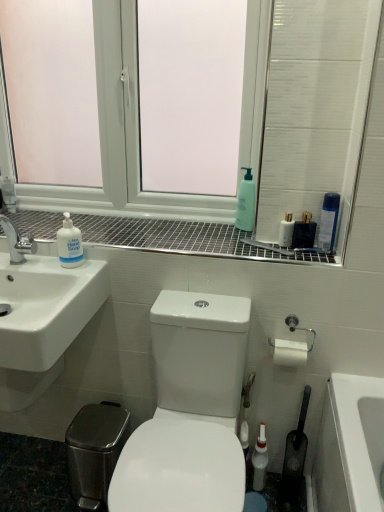
Question: Can white glossy mouthwash at upper right, positioned as the 2th mouthwash in bottom-to-top order, be found inside white glossy sink at lower left?

Choices:
 (A) yes
 (B) no

Answer: (B)

Question: Is white glossy mouthwash at upper right, positioned as the 2th mouthwash in bottom-to-top order, at the back of white glossy sink at lower left?

Choices:
 (A) no
 (B) yes

Answer: (A)

Question: Can you confirm if white glossy sink at lower left is smaller than white glossy mouthwash at upper right, marked as the second mouthwash in a right-to-left arrangement?

Choices:
 (A) no
 (B) yes

Answer: (A)

Question: From a real-world perspective, is white glossy sink at lower left located higher than white glossy mouthwash at upper right, marked as the second mouthwash in a right-to-left arrangement?

Choices:
 (A) no
 (B) yes

Answer: (A)

Question: Is white glossy sink at lower left bigger than white glossy mouthwash at upper right, which is counted as the 2th mouthwash, starting from the top?

Choices:
 (A) no
 (B) yes

Answer: (B)

Question: Is the position of white glossy sink at lower left more distant than that of white glossy mouthwash at upper right, the 2th mouthwash in the left-to-right sequence?

Choices:
 (A) yes
 (B) no

Answer: (B)

Question: Is white glossy mouthwash at upper right, marked as the second mouthwash in a right-to-left arrangement, closer to camera compared to green matte bottle at upper center?

Choices:
 (A) no
 (B) yes

Answer: (B)

Question: Can you see white glossy mouthwash at upper right, positioned as the 2th mouthwash in bottom-to-top order, touching green matte bottle at upper center?

Choices:
 (A) no
 (B) yes

Answer: (A)

Question: Is white glossy mouthwash at upper right, marked as the second mouthwash in a right-to-left arrangement, outside of green matte bottle at upper center?

Choices:
 (A) no
 (B) yes

Answer: (B)

Question: From the image's perspective, is white glossy mouthwash at upper right, the 2th mouthwash in the left-to-right sequence, over green matte bottle at upper center?

Choices:
 (A) yes
 (B) no

Answer: (B)

Question: From the image's perspective, is white glossy mouthwash at upper right, positioned as the 2th mouthwash in bottom-to-top order, below green matte bottle at upper center?

Choices:
 (A) yes
 (B) no

Answer: (A)

Question: Is white glossy mouthwash at upper right, the 2th mouthwash in the left-to-right sequence, to the right of green matte bottle at upper center from the viewer's perspective?

Choices:
 (A) yes
 (B) no

Answer: (A)

Question: Is white glossy toilet at center completely or partially inside silver metallic toilet paper holder at right?

Choices:
 (A) yes
 (B) no

Answer: (B)